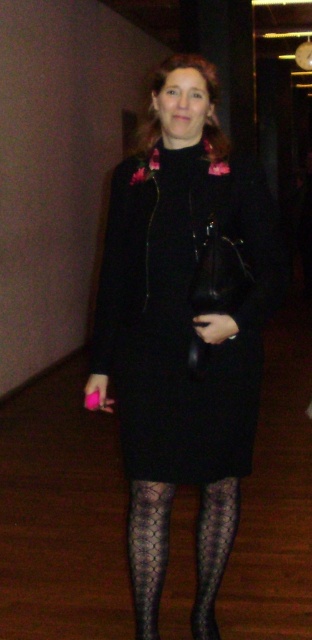
Can you confirm if black matte dress at center is thinner than black mesh tights at center?

In fact, black matte dress at center might be wider than black mesh tights at center.

Where is `black matte dress at center`? The image size is (312, 640). black matte dress at center is located at coordinates (184, 330).